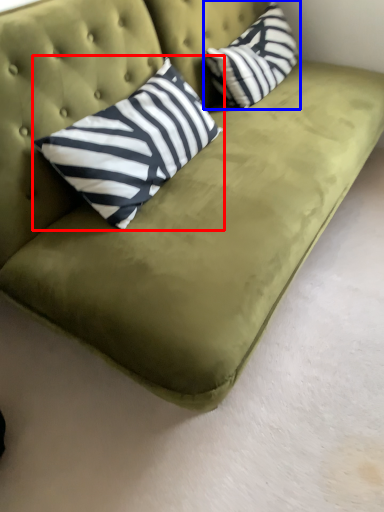
Question: Among these objects, which one is nearest to the camera, pillow (highlighted by a red box) or pillow (highlighted by a blue box)?

Choices:
 (A) pillow
 (B) pillow

Answer: (A)